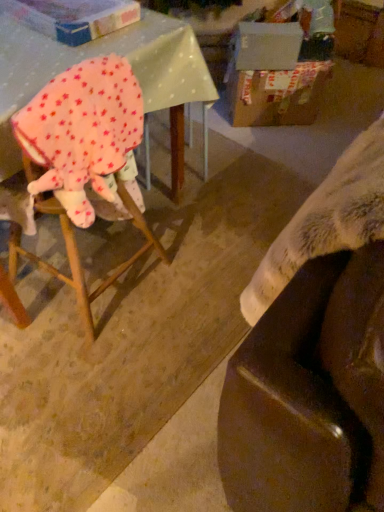
Question: Is cardboard box at upper right, which is the first cardboard box in back-to-front order, to the left or to the right of cardboard box at upper left, the second cardboard box positioned from the right, in the image?

Choices:
 (A) right
 (B) left

Answer: (A)

Question: Is cardboard box at upper right, which is the first cardboard box in back-to-front order, inside or outside of cardboard box at upper left, the second cardboard box when ordered from back to front?

Choices:
 (A) inside
 (B) outside

Answer: (B)

Question: Based on their relative distances, which object is nearer to the cardboard box at upper right, which is the first cardboard box from right to left?

Choices:
 (A) cardboard box at upper left, the first cardboard box viewed from the left
 (B) wooden chair at left
 (C) fluffy white blanket at lower right
 (D) pink fleece blanket at left

Answer: (A)

Question: Based on their relative distances, which object is nearer to the pink fleece blanket at left?

Choices:
 (A) fluffy white blanket at lower right
 (B) wooden chair at left
 (C) cardboard box at upper right, which is the first cardboard box in back-to-front order
 (D) cardboard box at upper left, the second cardboard box positioned from the right

Answer: (B)